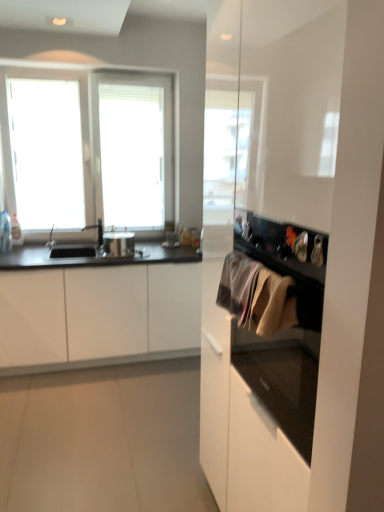
Question: Is shiny metallic pot at center closer to the viewer compared to silver metallic faucet at left?

Choices:
 (A) no
 (B) yes

Answer: (B)

Question: Is shiny metallic pot at center far from silver metallic faucet at left?

Choices:
 (A) yes
 (B) no

Answer: (B)

Question: Could silver metallic faucet at left be considered to be inside shiny metallic pot at center?

Choices:
 (A) yes
 (B) no

Answer: (B)

Question: Is shiny metallic pot at center at the right side of silver metallic faucet at left?

Choices:
 (A) yes
 (B) no

Answer: (A)

Question: Can we say shiny metallic pot at center lies outside silver metallic faucet at left?

Choices:
 (A) no
 (B) yes

Answer: (B)

Question: Can you see shiny metallic pot at center touching silver metallic faucet at left?

Choices:
 (A) yes
 (B) no

Answer: (B)

Question: Can you confirm if silver metallic faucet at left is bigger than shiny metallic pot at center?

Choices:
 (A) yes
 (B) no

Answer: (B)

Question: Is silver metallic faucet at left further to the viewer compared to shiny metallic pot at center?

Choices:
 (A) yes
 (B) no

Answer: (A)

Question: From the image's perspective, is silver metallic faucet at left below shiny metallic pot at center?

Choices:
 (A) no
 (B) yes

Answer: (A)

Question: From a real-world perspective, is silver metallic faucet at left physically above shiny metallic pot at center?

Choices:
 (A) yes
 (B) no

Answer: (A)

Question: Is silver metallic faucet at left shorter than shiny metallic pot at center?

Choices:
 (A) no
 (B) yes

Answer: (A)

Question: Is shiny metallic pot at center surrounded by silver metallic faucet at left?

Choices:
 (A) yes
 (B) no

Answer: (B)

Question: Is silver metallic faucet at left touching textured beige towel at center right?

Choices:
 (A) no
 (B) yes

Answer: (A)